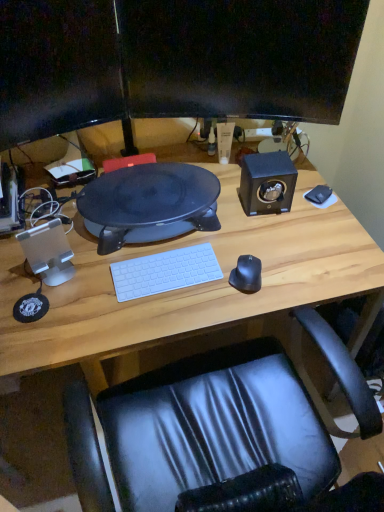
Locate an element on the screen. The width and height of the screenshot is (384, 512). free space in front of black matte mousepad at right is located at coordinates (322, 229).